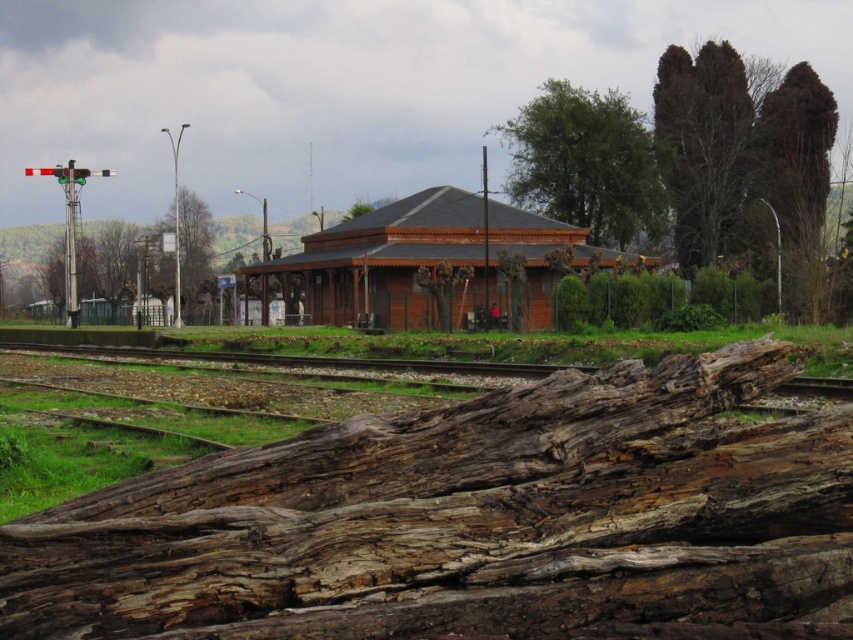
Which is in front, point (613, 134) or point (189, 284)?

Point (613, 134) is more forward.

Who is shorter, green leafy tree at upper right or green leafy tree at upper center?

green leafy tree at upper center is shorter.

What do you see at coordinates (585, 163) in the screenshot? I see `green leafy tree at upper right` at bounding box center [585, 163].

Find the location of a particular element. The image size is (853, 640). green leafy tree at upper right is located at coordinates (585, 163).

Looking at this image, which is more to the right, brown wooden railway station at center or green leafy tree at upper center?

brown wooden railway station at center

Can you confirm if brown wooden railway station at center is positioned to the left of green leafy tree at upper center?

No, brown wooden railway station at center is not to the left of green leafy tree at upper center.

Which is behind, point (386, 214) or point (189, 284)?

Point (189, 284)

Locate an element on the screen. The width and height of the screenshot is (853, 640). brown wooden railway station at center is located at coordinates (434, 264).

Is point (590, 616) farther from camera compared to point (648, 157)?

No, (590, 616) is closer to viewer.

Is weathered wood log at center shorter than green leafy tree at upper right?

Indeed, weathered wood log at center has a lesser height compared to green leafy tree at upper right.

Is point (341, 502) farther from viewer compared to point (612, 147)?

That is False.

Locate an element on the screen. Image resolution: width=853 pixels, height=640 pixels. weathered wood log at center is located at coordinates (468, 518).